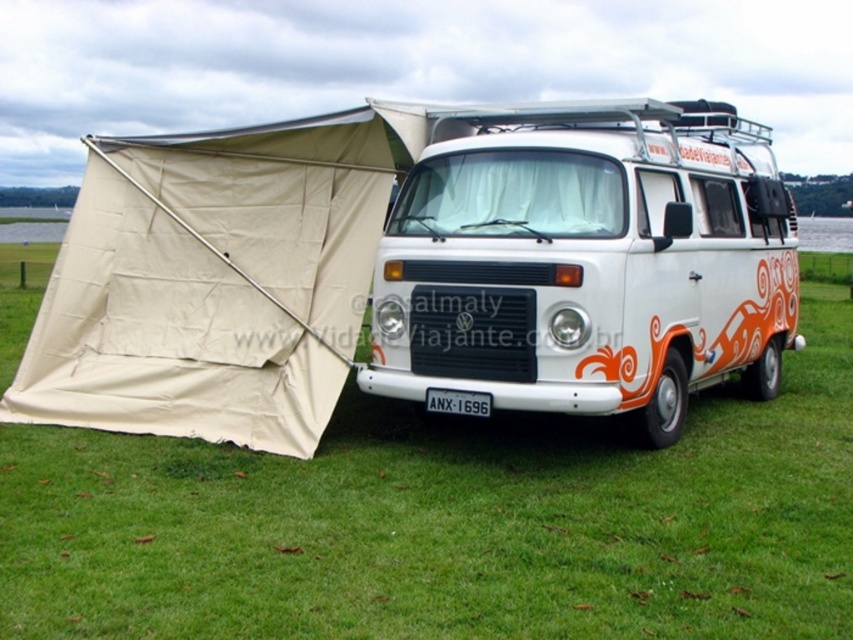
Is green grass at lower center shorter than white plastic license plate at center?

No, green grass at lower center is not shorter than white plastic license plate at center.

Is green grass at lower center smaller than white plastic license plate at center?

No.

Find the location of a particular element. green grass at lower center is located at coordinates (450, 522).

At what (x,y) coordinates should I click in order to perform the action: click on green grass at lower center. Please return your answer as a coordinate pair (x, y). This screenshot has width=853, height=640. Looking at the image, I should click on (450, 522).

Which is in front, point (402, 470) or point (672, 161)?

Point (402, 470) is more forward.

Measure the distance between green grass at lower center and white glossy van at center.

green grass at lower center is 1.45 meters from white glossy van at center.

Is point (465, 504) positioned in front of point (538, 397)?

That is True.

At what (x,y) coordinates should I click in order to perform the action: click on green grass at lower center. Please return your answer as a coordinate pair (x, y). This screenshot has height=640, width=853. Looking at the image, I should click on coord(450,522).

Looking at this image, who is more distant from viewer, (766, 291) or (450, 410)?

The point (766, 291) is more distant.

Is white glossy van at center wider than white plastic license plate at center?

Indeed, white glossy van at center has a greater width compared to white plastic license plate at center.

Looking at this image, who is more distant from viewer, (669,259) or (454,401)?

Positioned behind is point (669,259).

The image size is (853, 640). I want to click on white glossy van at center, so click(x=587, y=260).